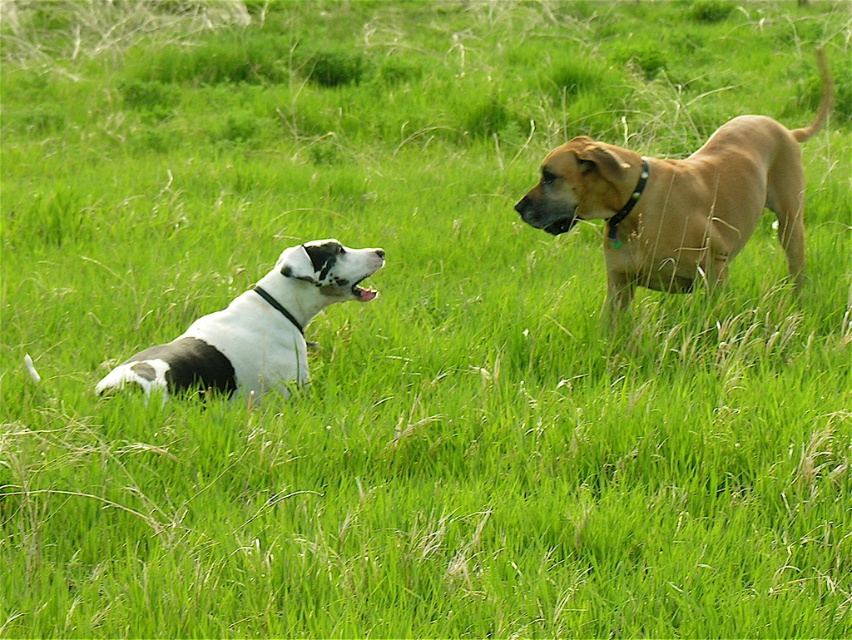
You are a photographer trying to capture a closeup shot of both the golden tan fur at right and the black leather neckband at upper right. Given that your camera can focus on objects within a 10 inch range, will you be able to capture both in focus?

The golden tan fur at right and the black leather neckband at upper right are 8.59 inches apart from each other, so yes, the camera can focus on both since the distance between them is within the 10 inch range.